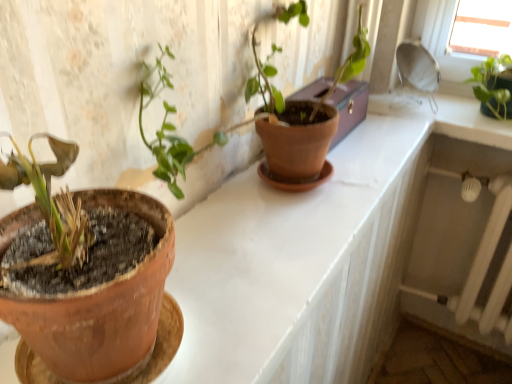
Question: From a real-world perspective, is terracotta clay pot at left physically above matte terracotta pot at center?

Choices:
 (A) no
 (B) yes

Answer: (B)

Question: From a real-world perspective, is terracotta clay pot at left located beneath matte terracotta pot at center?

Choices:
 (A) no
 (B) yes

Answer: (A)

Question: Is terracotta clay pot at left closer to camera compared to matte terracotta pot at center?

Choices:
 (A) yes
 (B) no

Answer: (A)

Question: Can you confirm if terracotta clay pot at left is wider than matte terracotta pot at center?

Choices:
 (A) no
 (B) yes

Answer: (A)

Question: From the image's perspective, would you say terracotta clay pot at left is positioned over matte terracotta pot at center?

Choices:
 (A) no
 (B) yes

Answer: (A)

Question: Is terracotta clay pot at left positioned behind matte terracotta pot at center?

Choices:
 (A) no
 (B) yes

Answer: (A)

Question: Does terracotta clay pot at left lie behind brown leather box at upper center?

Choices:
 (A) yes
 (B) no

Answer: (B)

Question: From the image's perspective, is terracotta clay pot at left located beneath brown leather box at upper center?

Choices:
 (A) yes
 (B) no

Answer: (A)

Question: Considering the relative sizes of terracotta clay pot at left and brown leather box at upper center in the image provided, is terracotta clay pot at left shorter than brown leather box at upper center?

Choices:
 (A) yes
 (B) no

Answer: (B)

Question: Is terracotta clay pot at left bigger than brown leather box at upper center?

Choices:
 (A) no
 (B) yes

Answer: (B)

Question: Is terracotta clay pot at left in front of brown leather box at upper center?

Choices:
 (A) no
 (B) yes

Answer: (B)

Question: Can you confirm if terracotta clay pot at left is smaller than brown leather box at upper center?

Choices:
 (A) no
 (B) yes

Answer: (A)

Question: Is green matte plant at upper right positioned with its back to matte terracotta pot at center?

Choices:
 (A) yes
 (B) no

Answer: (B)